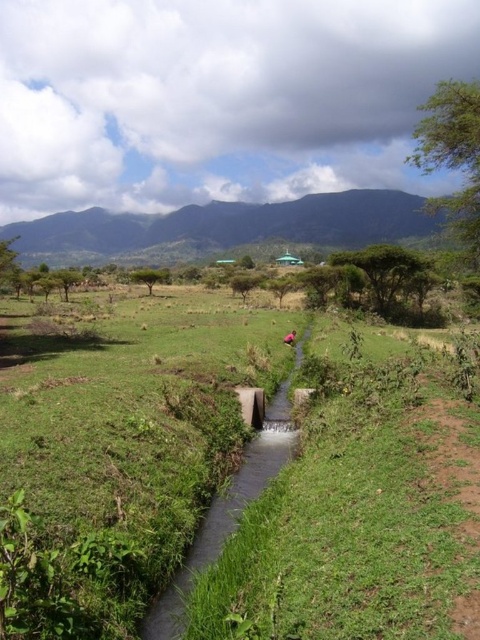
You are a farmer planning to plant crops in the area. You notice the green grassy at center and the green concrete stream at center. Which area would you choose to plant crops, and why?

The green grassy at center is wider than the green concrete stream at center, so it would provide more space for planting crops. The grassy area is also likely to be more fertile and suitable for agriculture compared to the concrete stream area.

Consider the image. You are a gardener planning to plant flowers along the green grassy at center and the green concrete stream at center. Which area is higher in elevation?

The green grassy at center is above the green concrete stream at center, so it has a higher elevation.